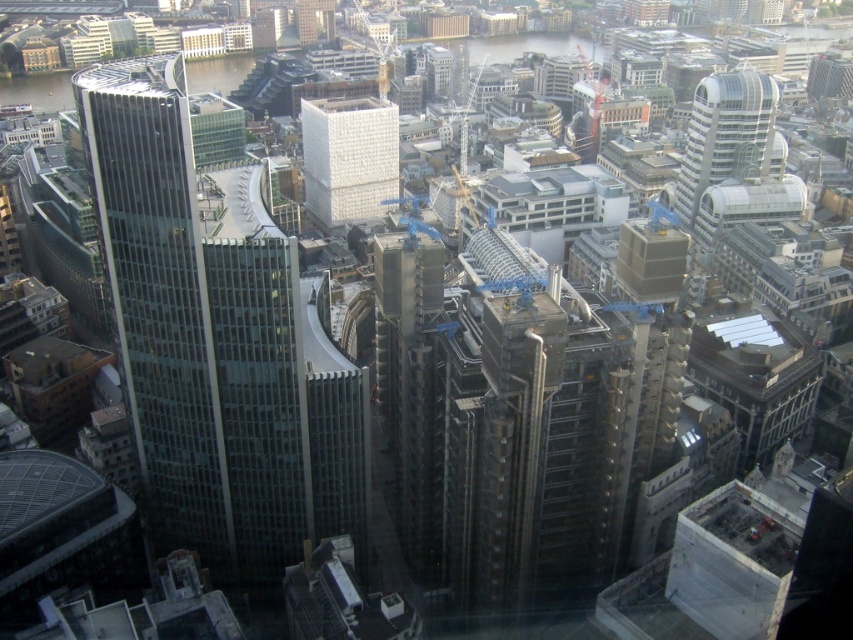
Question: Can you confirm if white textured cube at center is positioned to the left of glassy silver tower at upper right?

Choices:
 (A) no
 (B) yes

Answer: (B)

Question: Which point is farther to the camera?

Choices:
 (A) white textured cube at center
 (B) glassy steel skyscraper at left
 (C) glassy silver tower at upper right

Answer: (C)

Question: Is glassy steel skyscraper at left wider than white textured cube at center?

Choices:
 (A) no
 (B) yes

Answer: (A)

Question: Which object is closer to the camera taking this photo?

Choices:
 (A) glassy steel skyscraper at left
 (B) glassy silver tower at upper right

Answer: (A)

Question: Estimate the real-world distances between objects in this image. Which object is farther from the white textured cube at center?

Choices:
 (A) glassy steel skyscraper at left
 (B) glassy silver tower at upper right

Answer: (A)

Question: Is glassy steel skyscraper at left to the right of white textured cube at center from the viewer's perspective?

Choices:
 (A) no
 (B) yes

Answer: (A)